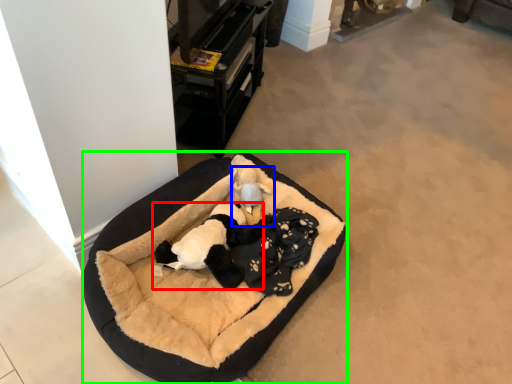
Question: Considering the real-world distances, which object is farthest from animal (highlighted by a red box)? toy (highlighted by a blue box) or dog bed (highlighted by a green box)?

Choices:
 (A) toy
 (B) dog bed

Answer: (A)